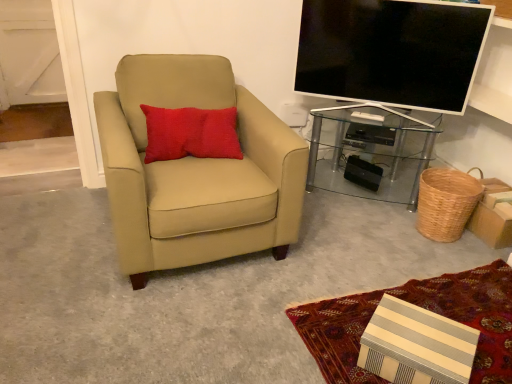
I want to click on empty space that is ontop of woven brown basket at lower right (from a real-world perspective), so click(x=448, y=174).